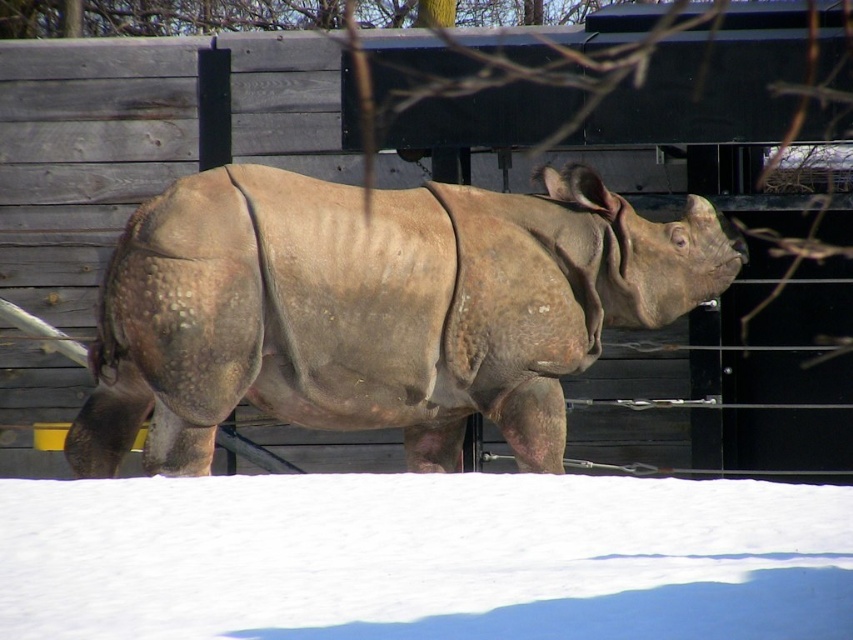
Question: Is gray textured rhino at center bigger than white powder snow at lower center?

Choices:
 (A) yes
 (B) no

Answer: (A)

Question: Among these points, which one is farthest from the camera?

Choices:
 (A) (228, 205)
 (B) (70, 541)

Answer: (A)

Question: Can you confirm if gray textured rhino at center is positioned to the right of white powder snow at lower center?

Choices:
 (A) yes
 (B) no

Answer: (B)

Question: Which point is closer to the camera?

Choices:
 (A) (585, 532)
 (B) (444, 259)

Answer: (A)

Question: Does gray textured rhino at center appear over white powder snow at lower center?

Choices:
 (A) yes
 (B) no

Answer: (A)

Question: Which point is farther to the camera?

Choices:
 (A) (33, 584)
 (B) (662, 304)

Answer: (B)